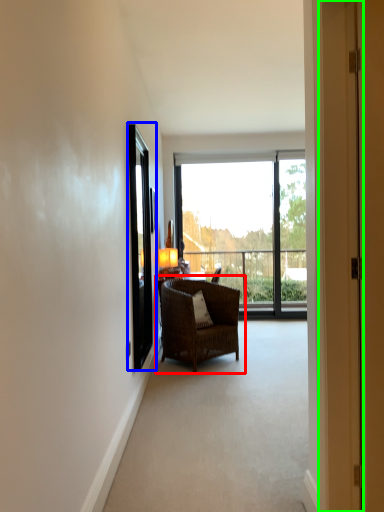
Question: Estimate the real-world distances between objects in this image. Which object is farther from chair (highlighted by a red box), screen door (highlighted by a blue box) or door (highlighted by a green box)?

Choices:
 (A) screen door
 (B) door

Answer: (B)